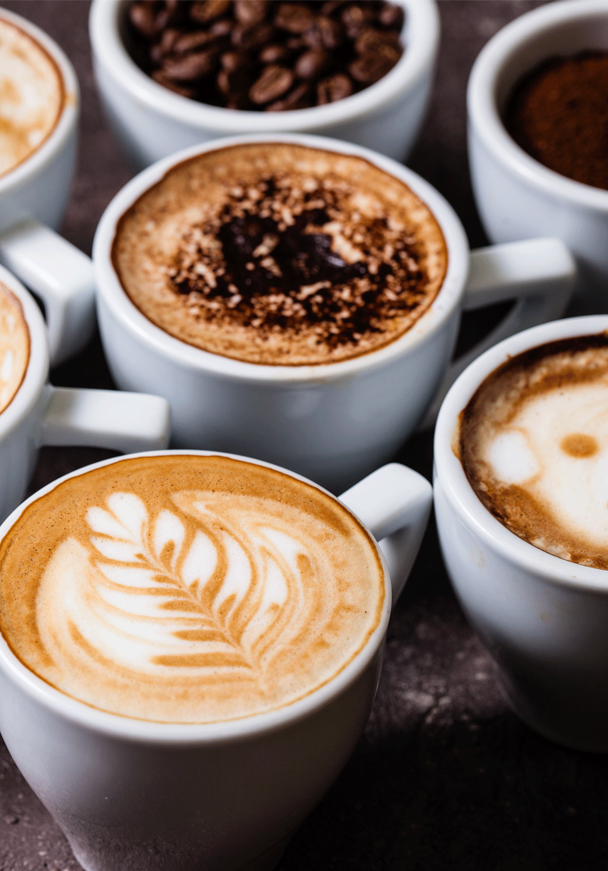
Locate an element on the screen. This screenshot has height=871, width=608. mugs is located at coordinates (489, 160), (376, 113), (361, 413), (461, 522), (215, 778), (25, 428), (40, 186).